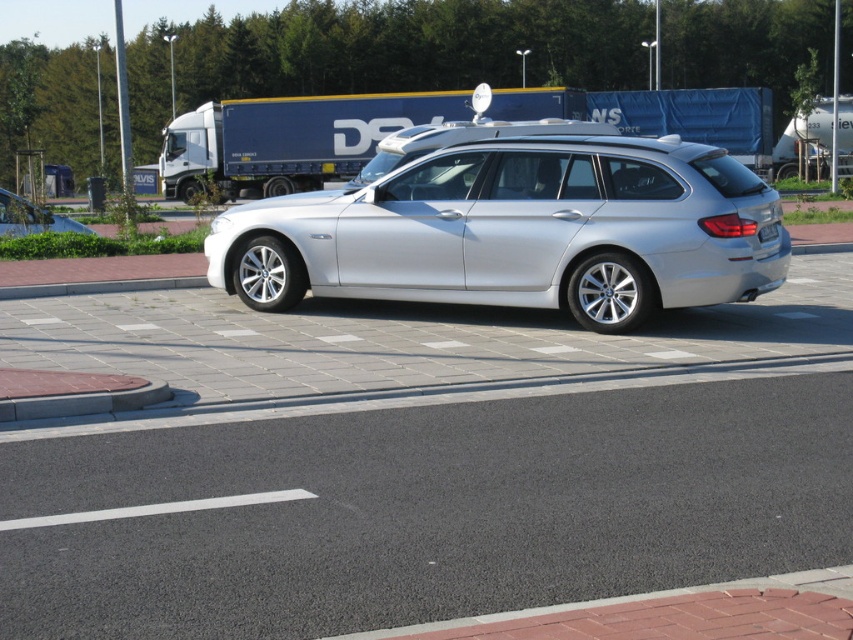
You are standing in front of the silver BMW station wagon parked near the DPD truck. There are two points marked on the car. One is at coordinate point (746, 132) and the other is at point (28, 224). Which point is closer to you?

Point (28, 224) is closer to you because it is nearer to the camera compared to point (746, 132), which is further away.